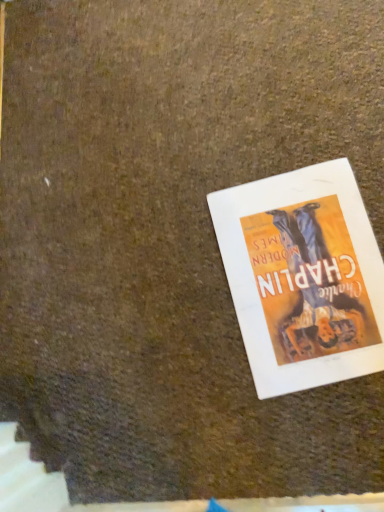
You are a GUI agent. You are given a task and a screenshot of the screen. Output one action in this format:
    pyautogui.click(x=<x>, y=<y>)
    Task: Click on the empty space that is ontop of white paper poster at center (from a real-world perspective)
    This screenshot has width=384, height=512.
    Given the screenshot: What is the action you would take?
    pyautogui.click(x=307, y=276)